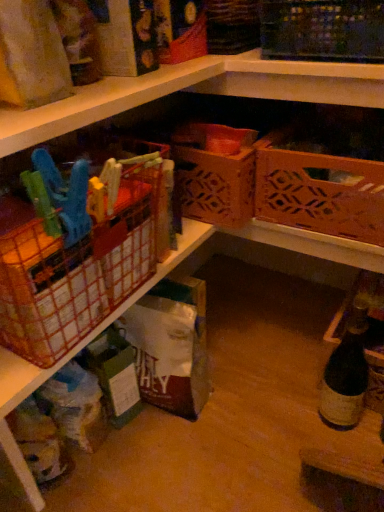
Question: Is the surface of orange plastic basket at left, the 3th basket in the right-to-left sequence, in direct contact with brown cardboard box at center?

Choices:
 (A) yes
 (B) no

Answer: (B)

Question: Considering the relative positions of orange plastic basket at left, the 3th basket in the right-to-left sequence, and brown cardboard box at center in the image provided, is orange plastic basket at left, the 3th basket in the right-to-left sequence, to the right of brown cardboard box at center from the viewer's perspective?

Choices:
 (A) yes
 (B) no

Answer: (B)

Question: Is orange plastic basket at left, which is counted as the first basket, starting from the left, behind brown cardboard box at center?

Choices:
 (A) yes
 (B) no

Answer: (B)

Question: Is orange plastic basket at left, which is counted as the first basket, starting from the left, positioned in front of brown cardboard box at center?

Choices:
 (A) yes
 (B) no

Answer: (A)

Question: Would you say brown cardboard box at center is part of orange plastic basket at left, which is counted as the first basket, starting from the left,'s contents?

Choices:
 (A) yes
 (B) no

Answer: (B)

Question: Is dark brown glass bottle at lower right situated inside orange plastic basket at left, the 3th basket in the right-to-left sequence, or outside?

Choices:
 (A) outside
 (B) inside

Answer: (A)

Question: Relative to orange plastic basket at left, which is counted as the first basket, starting from the left, is dark brown glass bottle at lower right in front or behind?

Choices:
 (A) front
 (B) behind

Answer: (B)

Question: From the image's perspective, is dark brown glass bottle at lower right positioned above or below orange plastic basket at left, which is counted as the first basket, starting from the left?

Choices:
 (A) below
 (B) above

Answer: (A)

Question: Is dark brown glass bottle at lower right to the left or to the right of orange plastic basket at left, which is counted as the first basket, starting from the left, in the image?

Choices:
 (A) right
 (B) left

Answer: (A)

Question: From a real-world perspective, is orange plastic basket at left, which is counted as the first basket, starting from the left, physically located above or below wooden lattice basket at upper right, positioned as the first basket in right-to-left order?

Choices:
 (A) below
 (B) above

Answer: (B)

Question: Is orange plastic basket at left, the 3th basket in the right-to-left sequence, inside the boundaries of wooden lattice basket at upper right, positioned as the first basket in right-to-left order, or outside?

Choices:
 (A) outside
 (B) inside

Answer: (A)

Question: In terms of width, does orange plastic basket at left, which is counted as the first basket, starting from the left, look wider or thinner when compared to wooden lattice basket at upper right, the third basket viewed from the left?

Choices:
 (A) thin
 (B) wide

Answer: (A)

Question: Considering the relative positions of orange plastic basket at left, the 3th basket in the right-to-left sequence, and wooden lattice basket at upper right, positioned as the first basket in right-to-left order, in the image provided, is orange plastic basket at left, the 3th basket in the right-to-left sequence, to the left or to the right of wooden lattice basket at upper right, positioned as the first basket in right-to-left order,?

Choices:
 (A) right
 (B) left

Answer: (B)

Question: Is brown cardboard box at center bigger or smaller than orange plastic basket at left, the 3th basket in the right-to-left sequence?

Choices:
 (A) small
 (B) big

Answer: (A)

Question: From their relative heights in the image, would you say brown cardboard box at center is taller or shorter than orange plastic basket at left, the 3th basket in the right-to-left sequence?

Choices:
 (A) short
 (B) tall

Answer: (B)